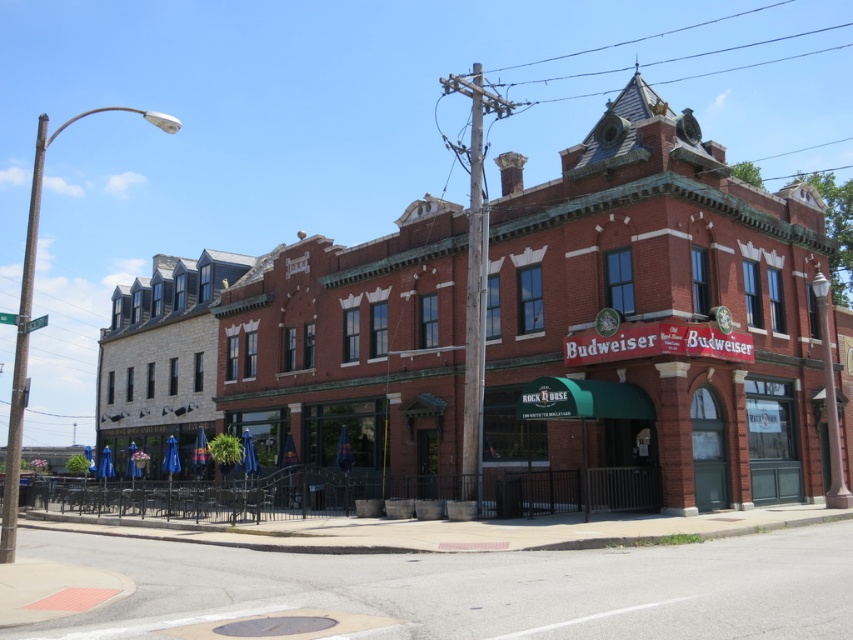
You are standing on the concrete sidewalk at lower center and want to enter the red brick building at center. Which direction should you walk to reach the entrance?

Since the red brick building at center is to the left of the concrete sidewalk at lower center, you should walk to the left to reach the entrance.

You are standing at the entrance of the building and want to take a photo of the red brick building at center. Where should you position yourself to capture the entire building in the frame?

To capture the entire red brick building at center in the frame, position yourself at the entrance and ensure your camera is centered at point (653, 321) as specified in the building description.

Consider the image. You are a delivery person trying to park your 2.5 meter wide delivery truck in front of the red brick building at center. The concrete sidewalk at lower center is adjacent to the parking spot. Based on the scene, will the truck fit without encroaching on the sidewalk?

The red brick building at center is wider than the concrete sidewalk at lower center. Since the sidewalk is narrower than the building, the truck might not fit entirely within the sidewalk area. However, the question specifies parking in front of the building, not on the sidewalk. Assuming the parking spot is in front of the building and the building itself is wider, the truck should fit as long as the parking area aligns with the building width. But the sidewalk being narrower means encroaching might occur